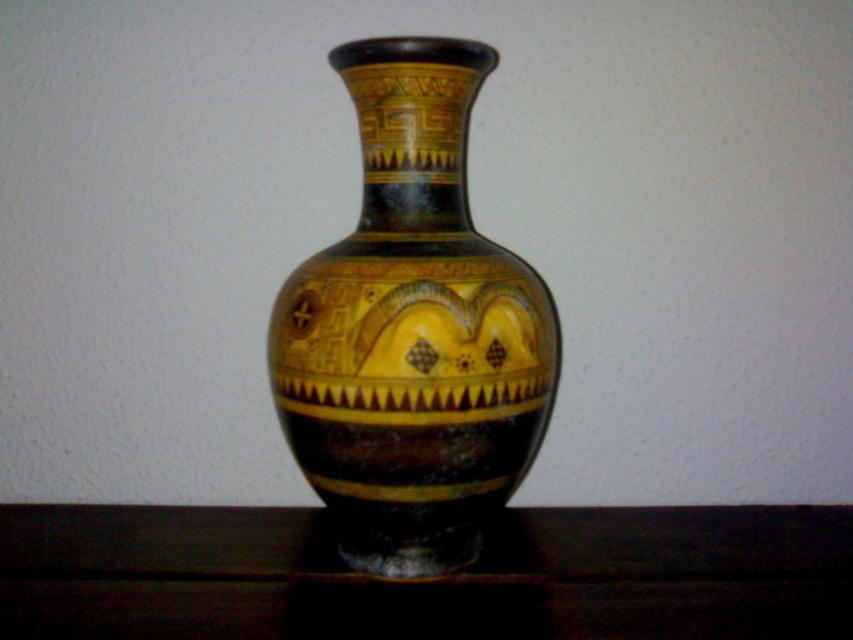
Does matte black vase at center come behind glossy wood table at lower center?

Yes, matte black vase at center is further from the viewer.

Between point (465, 131) and point (761, 534), which one is positioned in front?

Point (465, 131)

Image resolution: width=853 pixels, height=640 pixels. Describe the element at coordinates (413, 330) in the screenshot. I see `matte black vase at center` at that location.

Image resolution: width=853 pixels, height=640 pixels. I want to click on matte black vase at center, so click(413, 330).